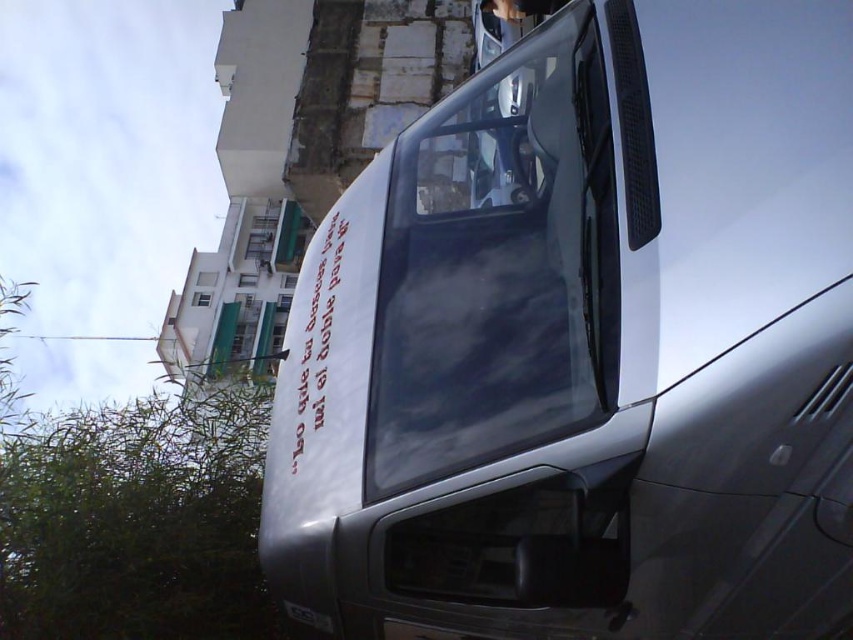
Question: Does satin metallic van at center lie behind white glass window at upper left?

Choices:
 (A) yes
 (B) no

Answer: (B)

Question: Based on their relative distances, which object is farther from the transparent glass windshield at center?

Choices:
 (A) satin metallic van at center
 (B) white glass window at upper left

Answer: (B)

Question: Does transparent glass windshield at center have a larger size compared to white glass window at upper left?

Choices:
 (A) yes
 (B) no

Answer: (A)

Question: Which point is closer to the camera?

Choices:
 (A) satin metallic van at center
 (B) white glass window at upper left
 (C) transparent glass windshield at center

Answer: (A)

Question: Which object is the closest to the transparent glass windshield at center?

Choices:
 (A) satin metallic van at center
 (B) white glass window at upper left

Answer: (A)

Question: Does transparent glass windshield at center have a larger size compared to white glass window at upper left?

Choices:
 (A) no
 (B) yes

Answer: (B)